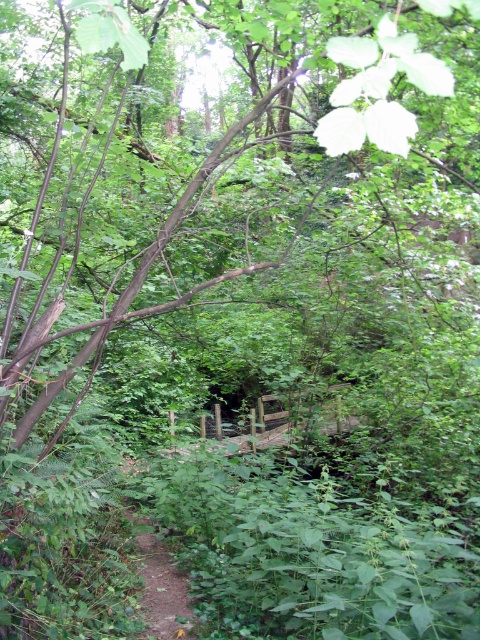
Question: Does brown wood tree at center appear on the right side of brown dirt path at lower left?

Choices:
 (A) no
 (B) yes

Answer: (B)

Question: Among these objects, which one is farthest from the camera?

Choices:
 (A) brown wood tree at center
 (B) brown dirt path at lower left

Answer: (B)

Question: Can you confirm if brown wood tree at center is bigger than brown dirt path at lower left?

Choices:
 (A) no
 (B) yes

Answer: (B)

Question: Which of the following is the farthest from the observer?

Choices:
 (A) (168, 624)
 (B) (227, 241)

Answer: (B)

Question: Is brown wood tree at center smaller than brown dirt path at lower left?

Choices:
 (A) yes
 (B) no

Answer: (B)